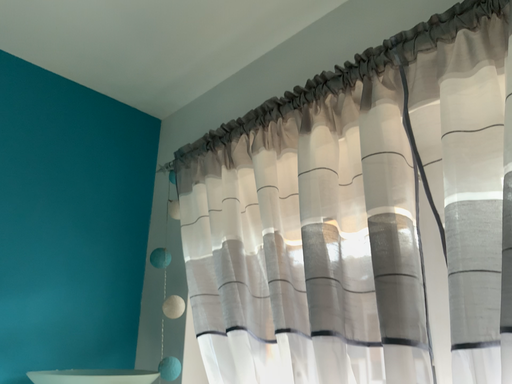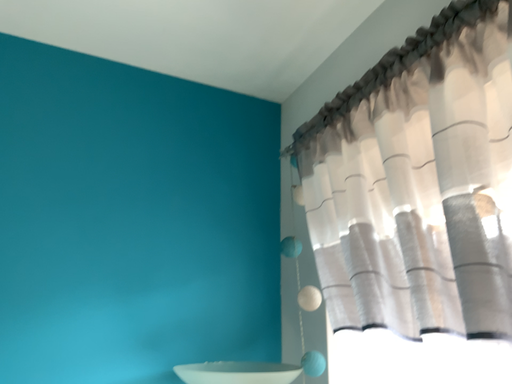
Question: How did the camera likely rotate when shooting the video?

Choices:
 (A) rotated left
 (B) rotated right

Answer: (A)